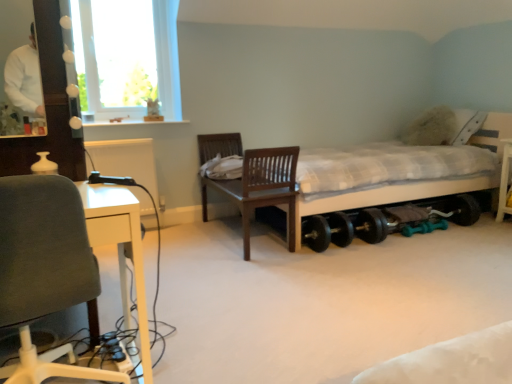
Where is `vacant space that's between gray fabric chair at left, which appears as the 1th chair when viewed from the left, and black rubber wheel at lower center`? vacant space that's between gray fabric chair at left, which appears as the 1th chair when viewed from the left, and black rubber wheel at lower center is located at coordinates (283, 299).